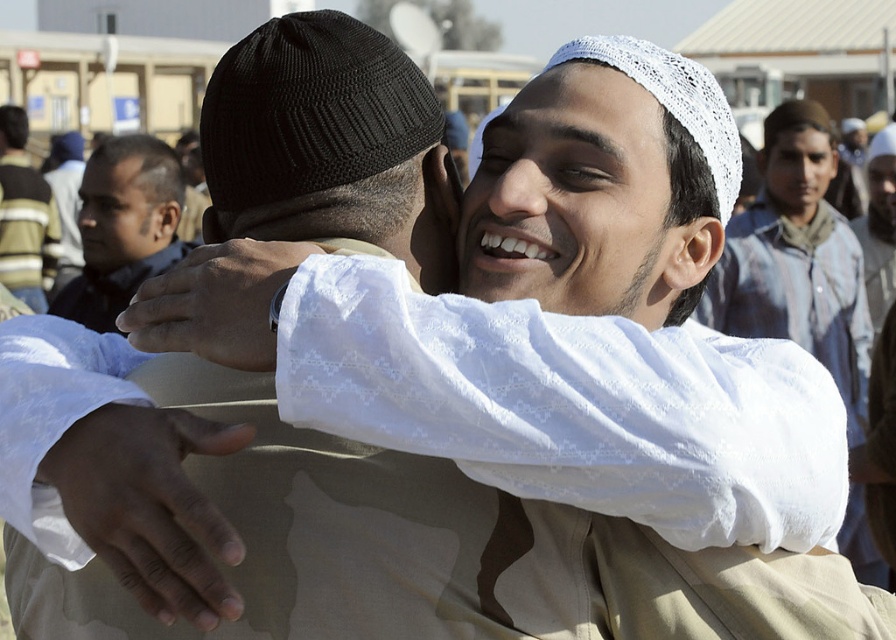
Question: Among these points, which one is nearest to the camera?

Choices:
 (A) (115, 317)
 (B) (859, 488)

Answer: (A)

Question: From the image, what is the correct spatial relationship of white lace shirt at upper center in relation to brown leather jacket at left?

Choices:
 (A) left
 (B) right

Answer: (B)

Question: Which object appears farthest from the camera in this image?

Choices:
 (A) white lace shirt at upper center
 (B) brown leather jacket at left

Answer: (A)

Question: Does white lace shirt at upper center have a smaller size compared to brown leather jacket at left?

Choices:
 (A) no
 (B) yes

Answer: (A)

Question: Can you confirm if white lace shirt at upper center is thinner than brown leather jacket at left?

Choices:
 (A) yes
 (B) no

Answer: (B)